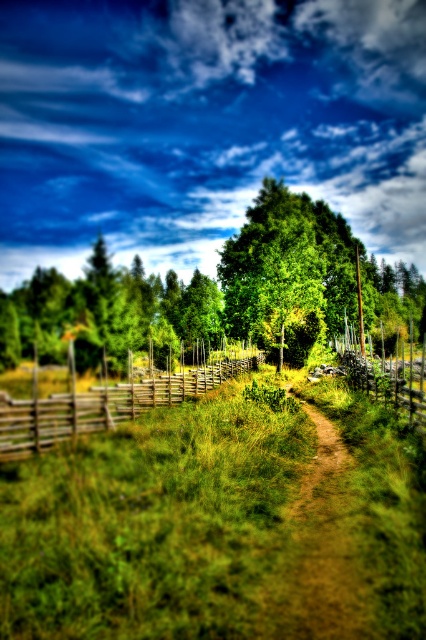
Does green grass at center appear on the right side of wooden at center-right?

Incorrect, green grass at center is not on the right side of wooden at center-right.

Between point (149, 580) and point (408, 346), which one is positioned behind?

Point (408, 346)

Locate an element on the screen. green grass at center is located at coordinates (218, 525).

Between green leafy tree at center and brown dirt track at center, which one is positioned lower?

Positioned lower is brown dirt track at center.

Is green leafy tree at center below brown dirt track at center?

Actually, green leafy tree at center is above brown dirt track at center.

Is point (328, 268) farther from camera compared to point (311, 499)?

Yes, point (328, 268) is behind point (311, 499).

The image size is (426, 640). I want to click on green leafy tree at center, so click(x=218, y=291).

Where is `green grass at center`? This screenshot has height=640, width=426. green grass at center is located at coordinates (218, 525).

Is green grass at center above wooden fence at left?

Correct, green grass at center is located above wooden fence at left.

Which is in front, point (282, 435) or point (34, 448)?

Positioned in front is point (34, 448).

Where is `green grass at center`? The width and height of the screenshot is (426, 640). green grass at center is located at coordinates (218, 525).